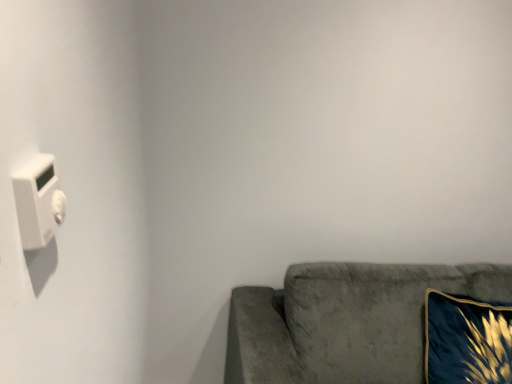
Question: Is the depth of velvet gray couch at lower right greater than that of velvet blue pillow at lower right?

Choices:
 (A) no
 (B) yes

Answer: (A)

Question: Is velvet gray couch at lower right facing away from velvet blue pillow at lower right?

Choices:
 (A) yes
 (B) no

Answer: (A)

Question: From a real-world perspective, is velvet gray couch at lower right positioned under velvet blue pillow at lower right based on gravity?

Choices:
 (A) yes
 (B) no

Answer: (A)

Question: Is velvet gray couch at lower right located outside velvet blue pillow at lower right?

Choices:
 (A) no
 (B) yes

Answer: (B)

Question: Is velvet gray couch at lower right oriented towards velvet blue pillow at lower right?

Choices:
 (A) yes
 (B) no

Answer: (A)

Question: From the image's perspective, does velvet gray couch at lower right appear higher than velvet blue pillow at lower right?

Choices:
 (A) no
 (B) yes

Answer: (A)

Question: From the image's perspective, is white plastic light switch at left located beneath velvet gray couch at lower right?

Choices:
 (A) yes
 (B) no

Answer: (B)

Question: Are white plastic light switch at left and velvet gray couch at lower right located far from each other?

Choices:
 (A) no
 (B) yes

Answer: (B)

Question: From a real-world perspective, is white plastic light switch at left beneath velvet gray couch at lower right?

Choices:
 (A) yes
 (B) no

Answer: (B)

Question: Is white plastic light switch at left aimed at velvet gray couch at lower right?

Choices:
 (A) no
 (B) yes

Answer: (A)

Question: Considering the relative sizes of white plastic light switch at left and velvet gray couch at lower right in the image provided, is white plastic light switch at left smaller than velvet gray couch at lower right?

Choices:
 (A) yes
 (B) no

Answer: (A)

Question: Is white plastic light switch at left not within velvet gray couch at lower right?

Choices:
 (A) yes
 (B) no

Answer: (A)

Question: Can you confirm if velvet blue pillow at lower right is thinner than white plastic light switch at left?

Choices:
 (A) no
 (B) yes

Answer: (A)